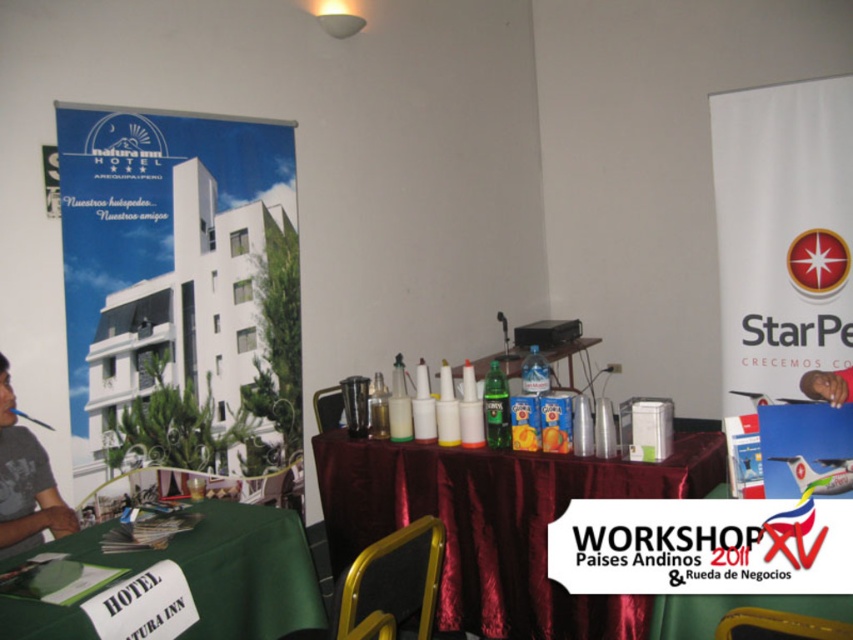
You are a photographer taking a picture of the smooth skin face at center and the translucent plastic bottles at center. Which object is closer to the camera?

The smooth skin face at center is closer to the camera because the translucent plastic bottles at center is positioned under it, meaning it is behind the face.